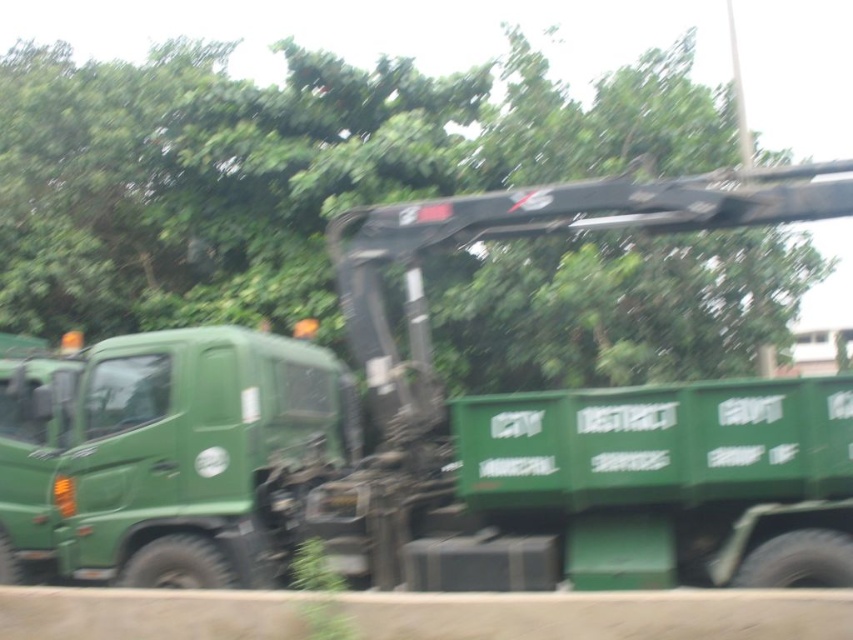
You are a city planner reviewing a photo of a green truck and a tree. The truck is labeled as the green matte tow truck at center and the tree is labeled as the green matte tree at upper center. Based on the image, which object appears smaller in the photo?

The green matte tow truck at center appears smaller in the photo compared to the green matte tree at upper center.

You are a city planner reviewing this image to assess potential safety hazards. The green matte tow truck at center and the green matte tree at upper center are both present. Based on their positions, is there a risk of the tree falling onto the truck during strong winds?

The green matte tow truck at center is positioned under green matte tree at upper center, so there is a risk of the tree falling onto the truck during strong winds.